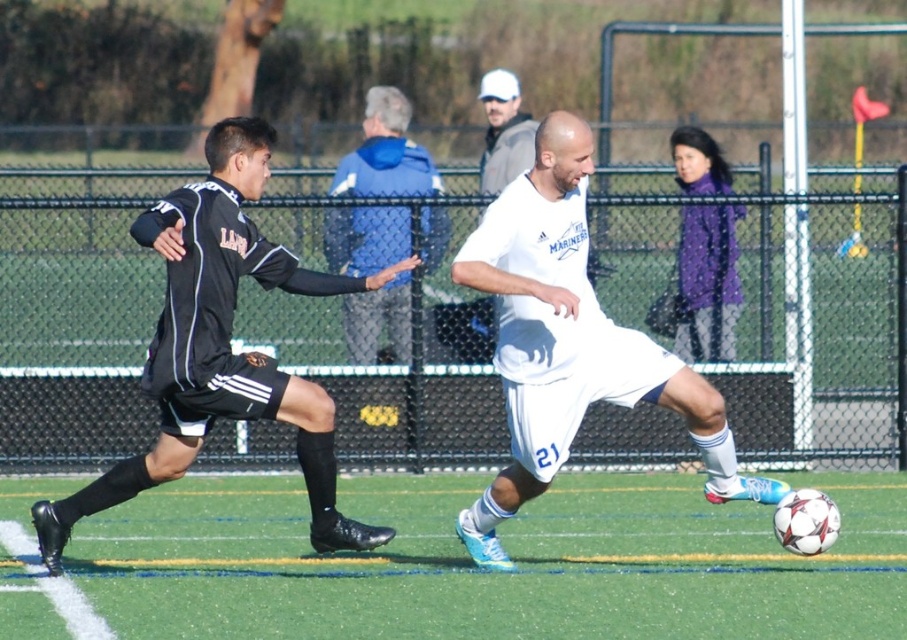
Which of these two, green artificial turf at center or white matte soccer ball at center, stands shorter?

Standing shorter between the two is green artificial turf at center.

Does green artificial turf at center appear over white matte soccer ball at center?

Incorrect, green artificial turf at center is not positioned above white matte soccer ball at center.

At what (x,y) coordinates should I click in order to perform the action: click on green artificial turf at center. Please return your answer as a coordinate pair (x, y). The height and width of the screenshot is (640, 907). Looking at the image, I should click on (486, 572).

Where is `green artificial turf at center`? The width and height of the screenshot is (907, 640). green artificial turf at center is located at coordinates (486, 572).

Is white matte soccer ball at center smaller than black matte soccer player at left?

Indeed, white matte soccer ball at center has a smaller size compared to black matte soccer player at left.

Is point (461, 282) closer to viewer compared to point (330, 476)?

Yes, point (461, 282) is closer to viewer.

Locate an element on the screen. Image resolution: width=907 pixels, height=640 pixels. white matte soccer ball at center is located at coordinates click(569, 340).

Find the location of `white matte soccer ball at center`. white matte soccer ball at center is located at coordinates (569, 340).

Is black matte soccer player at left further to camera compared to blue fleece jacket at upper center?

No, it is not.

Is point (190, 253) in front of point (338, 193)?

Yes, it is.

I want to click on black matte soccer player at left, so click(222, 346).